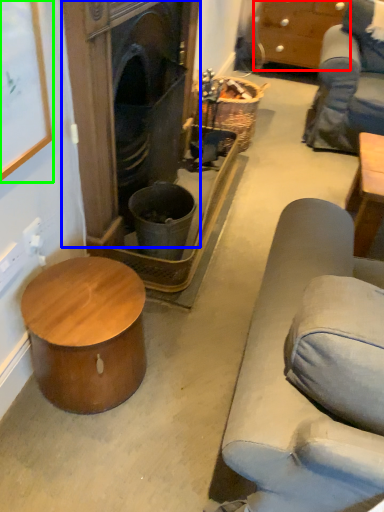
Question: Based on their relative distances, which object is nearer to cabinetry (highlighted by a red box)? Choose from fireplace (highlighted by a blue box) and picture frame (highlighted by a green box).

Choices:
 (A) fireplace
 (B) picture frame

Answer: (A)